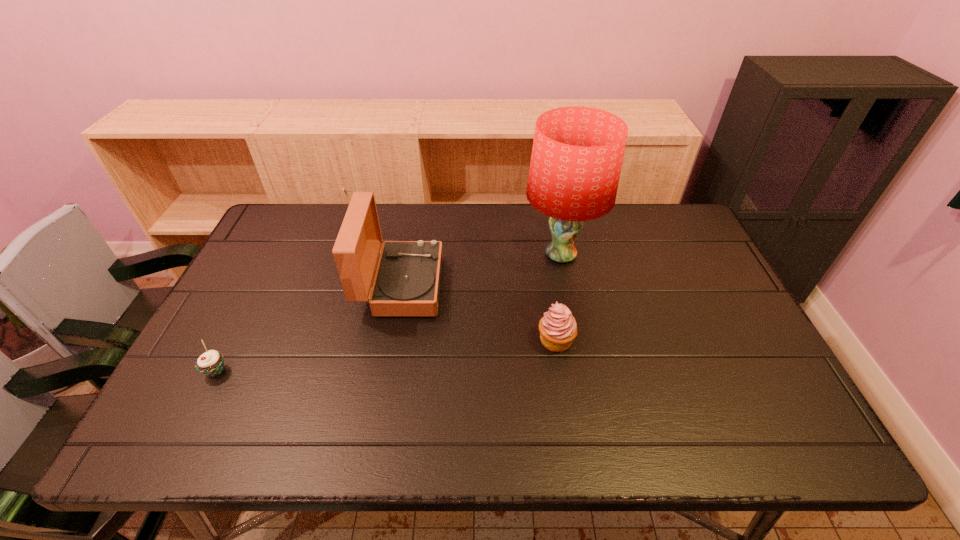
Where is `free space located on the face of the second object from left to right`? The image size is (960, 540). free space located on the face of the second object from left to right is located at coordinates (558, 286).

Where is `vacant space located 0.110m on the back of the farther cupcake`? vacant space located 0.110m on the back of the farther cupcake is located at coordinates click(549, 295).

This screenshot has height=540, width=960. Find the location of `vacant region located 0.110m on the front of the nearer cupcake`. vacant region located 0.110m on the front of the nearer cupcake is located at coordinates (188, 425).

At what (x,y) coordinates should I click in order to perform the action: click on object located in the far edge section of the desktop. Please return your answer as a coordinate pair (x, y). Looking at the image, I should click on (577, 154).

This screenshot has height=540, width=960. Identify the location of object that is positioned at the left edge. (211, 363).

I want to click on free space at the far edge of the desktop, so click(x=491, y=208).

The height and width of the screenshot is (540, 960). Find the location of `vacant region at the near edge of the desktop`. vacant region at the near edge of the desktop is located at coordinates (611, 418).

Identify the location of vacant space at the left edge of the desktop. (252, 264).

Where is `vacant space at the right edge`? Image resolution: width=960 pixels, height=540 pixels. vacant space at the right edge is located at coordinates (732, 401).

This screenshot has height=540, width=960. In order to click on vacant region at the far left corner of the desktop in this screenshot , I will do `click(319, 222)`.